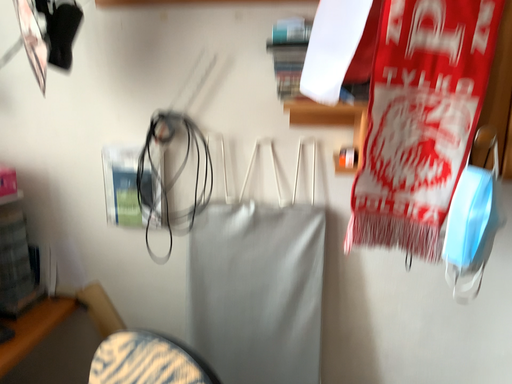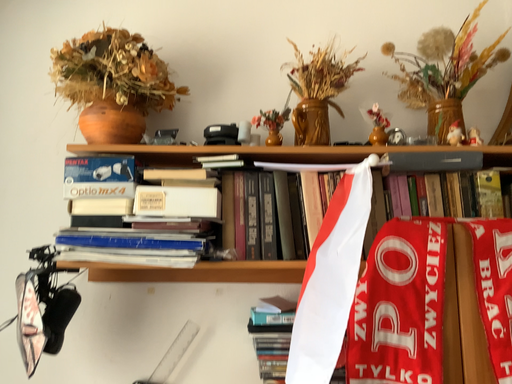
Question: Which way did the camera rotate in the video?

Choices:
 (A) rotated right
 (B) rotated left

Answer: (A)